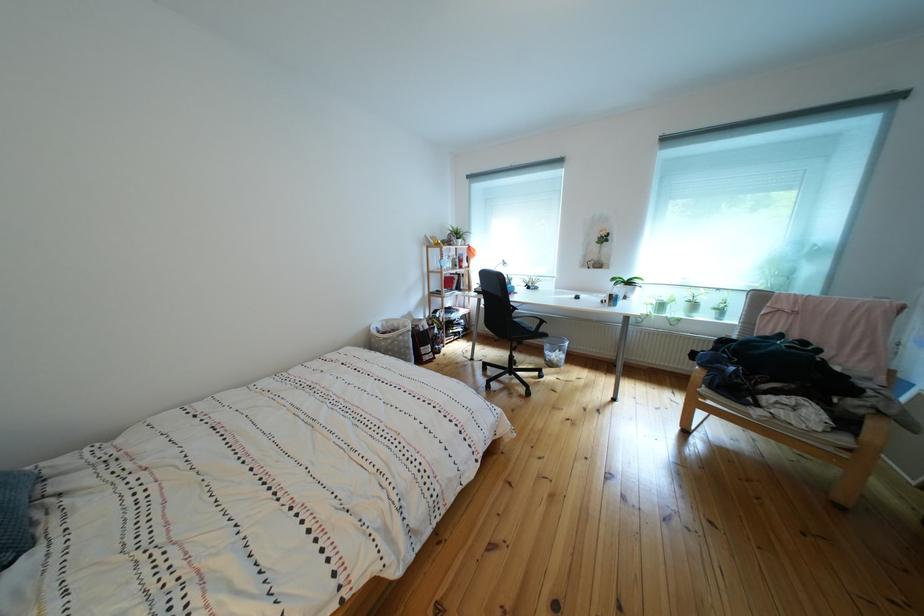
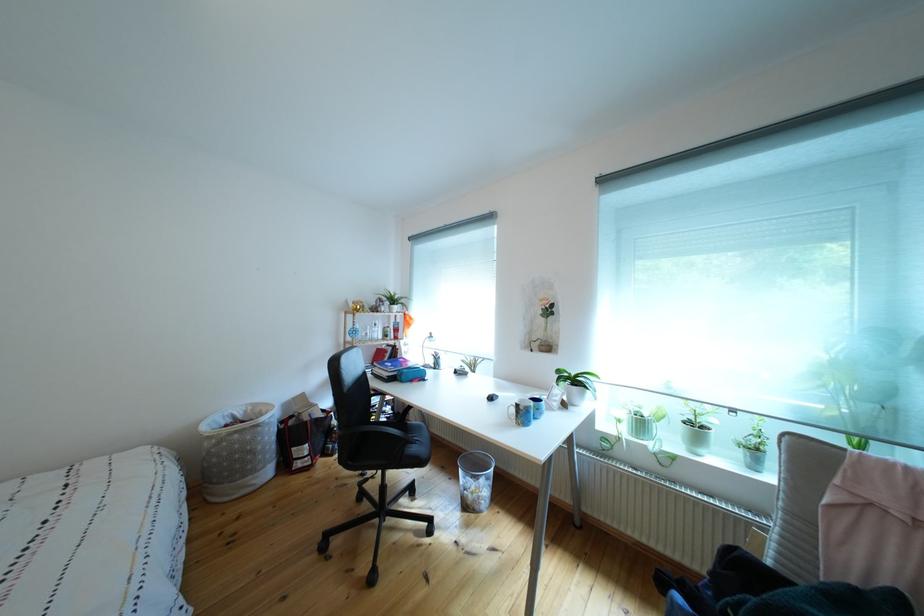
Find the pixel in the second image that matches [563,371] in the first image.

(477, 512)